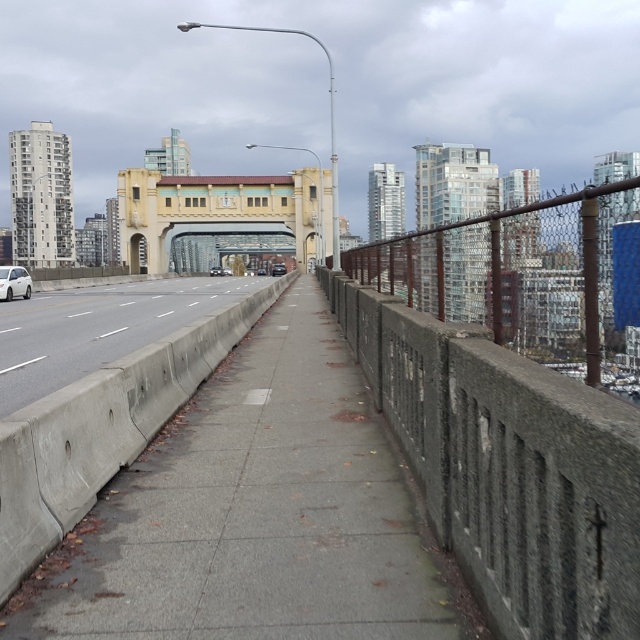
In the scene shown: You are standing on the pedestrian walkway and want to take a photo of both the yellow matte bridge at center and the shiny silver sedan at center. Which object should you focus on first to ensure both are in sharp focus?

You should focus on the yellow matte bridge at center first because it is closer to you than the shiny silver sedan at center. By focusing on the closer object, the farther one may still be in acceptable focus depending on the camera settings.

You are standing on the pedestrian walkway of the bridge and want to cross to the other side. The gray concrete highway at center is in your way. Is there a path around it on either side?

The gray concrete highway at center is located at point (97, 328), which is directly in the center of the bridge. Since the highway is in the center, there is no path around it on either side as it spans the entire width of the bridge.

You are standing on the pedestrian walkway and want to take a photo of the shiny silver sedan at center without including the yellow matte bridge at center in the frame. Which direction should you move to achieve this?

The yellow matte bridge at center is to the left of the shiny silver sedan at center. To exclude the bridge from the photo, move to the right side of the pedestrian walkway so that the bridge is out of the frame.